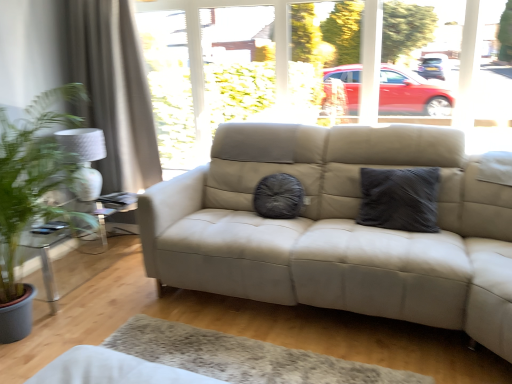
Question: From the image's perspective, does white textured curtain at left appear lower than clear glass table at left?

Choices:
 (A) no
 (B) yes

Answer: (A)

Question: Is white textured curtain at left smaller than clear glass table at left?

Choices:
 (A) yes
 (B) no

Answer: (B)

Question: Can you confirm if white textured curtain at left is bigger than clear glass table at left?

Choices:
 (A) no
 (B) yes

Answer: (B)

Question: Considering the relative sizes of white textured curtain at left and clear glass table at left in the image provided, is white textured curtain at left wider than clear glass table at left?

Choices:
 (A) yes
 (B) no

Answer: (B)

Question: Is white textured curtain at left far away from clear glass table at left?

Choices:
 (A) yes
 (B) no

Answer: (B)

Question: Could clear glass table at left be considered to be inside white textured curtain at left?

Choices:
 (A) no
 (B) yes

Answer: (A)

Question: Is the depth of dark grey textured pillow at center less than that of clear glass table at left?

Choices:
 (A) no
 (B) yes

Answer: (B)

Question: Is dark grey textured pillow at center at the left side of clear glass table at left?

Choices:
 (A) yes
 (B) no

Answer: (B)

Question: From the image's perspective, would you say dark grey textured pillow at center is positioned over clear glass table at left?

Choices:
 (A) no
 (B) yes

Answer: (B)

Question: Would you consider dark grey textured pillow at center to be distant from clear glass table at left?

Choices:
 (A) no
 (B) yes

Answer: (B)

Question: Can you confirm if dark grey textured pillow at center is bigger than clear glass table at left?

Choices:
 (A) no
 (B) yes

Answer: (A)

Question: Is dark grey textured pillow at center positioned with its back to clear glass table at left?

Choices:
 (A) yes
 (B) no

Answer: (B)

Question: Does white textured curtain at left have a greater height compared to dark grey textured pillow at center?

Choices:
 (A) yes
 (B) no

Answer: (A)